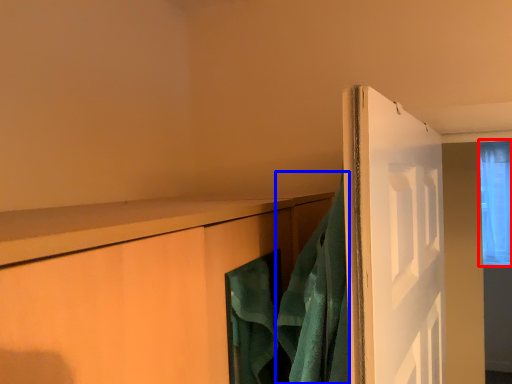
Question: Which of the following is the closest to the observer, window (highlighted by a red box) or bath towel (highlighted by a blue box)?

Choices:
 (A) window
 (B) bath towel

Answer: (B)